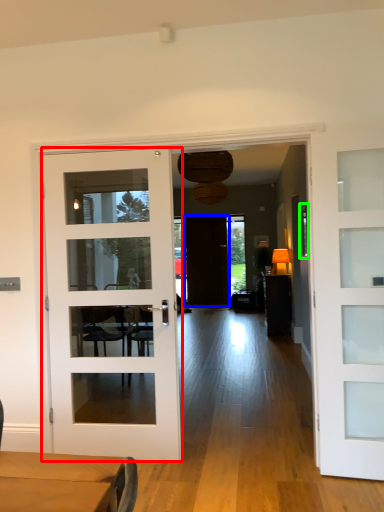
Question: Which object is the closest to the door (highlighted by a red box)? Choose among these: door (highlighted by a blue box) or window (highlighted by a green box).

Choices:
 (A) door
 (B) window

Answer: (B)